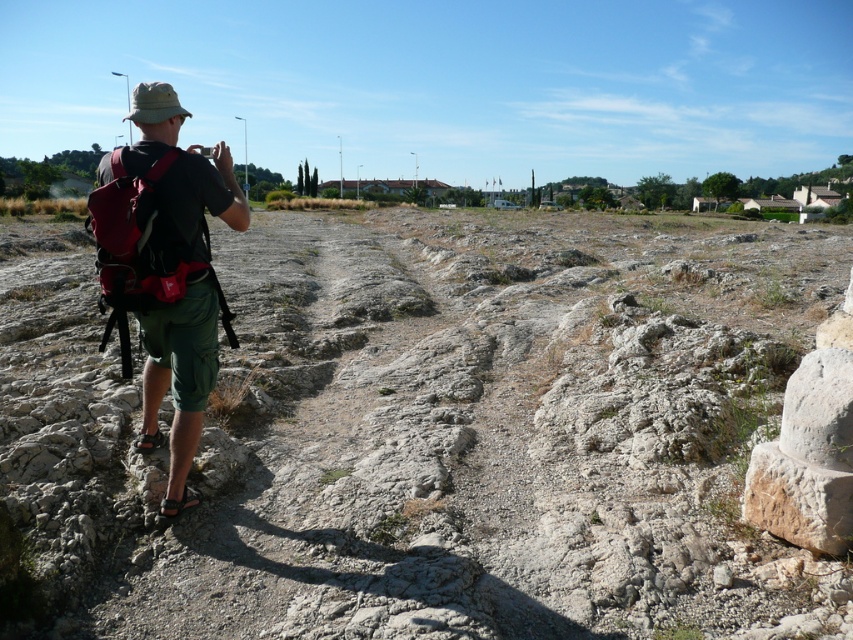
You are a hiker who wants to place your green fabric shorts at left on the gray rocky terrain at center. Will the shorts be visible from above once placed?

The gray rocky terrain at center has a greater height compared to green fabric shorts at left. Since the terrain is higher, the shorts placed on it would be elevated, making them more visible from above.

Based on the photo, you are standing at the point marked by the coordinates point (430, 429), which is the gray rocky terrain at center. What is the nearest object to you in this scene?

The nearest object to you at point (430, 429) is the gray rocky terrain at center itself, as you are standing on it.

You are standing at the point with coordinates point (196,237) and want to walk towards the point with coordinates point (206,230). Which direction should you face to move towards it?

You should face towards the direction of point (206,230), which is behind point (196,237), so you need to walk in the direction opposite to where point (196,237) is located.